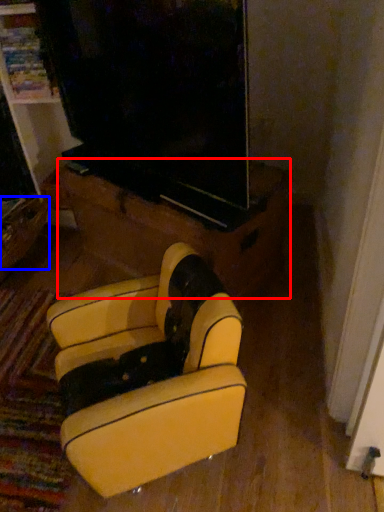
Question: Which of the following is the closest to the observer, furniture (highlighted by a red box) or drawer (highlighted by a blue box)?

Choices:
 (A) furniture
 (B) drawer

Answer: (A)